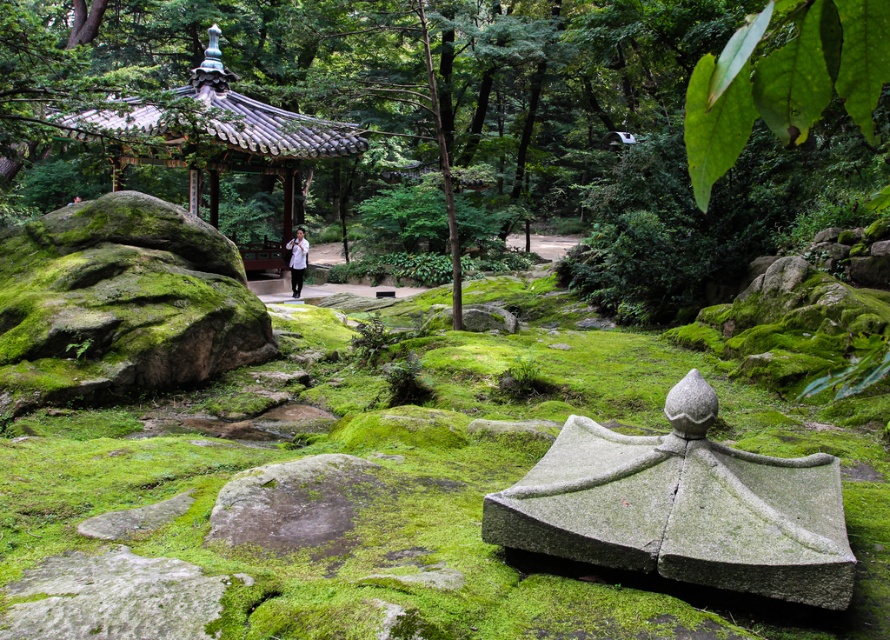
You are a photographer standing in the garden and want to capture both the green mossy rock at center and the white matte shirt at center in a single frame. Based on their positions, which object should you adjust your camera to focus on first to ensure both are in the shot?

The green mossy rock at center is to the right of the white matte shirt at center, so you should focus on the white matte shirt at center first to ensure both are in the frame.